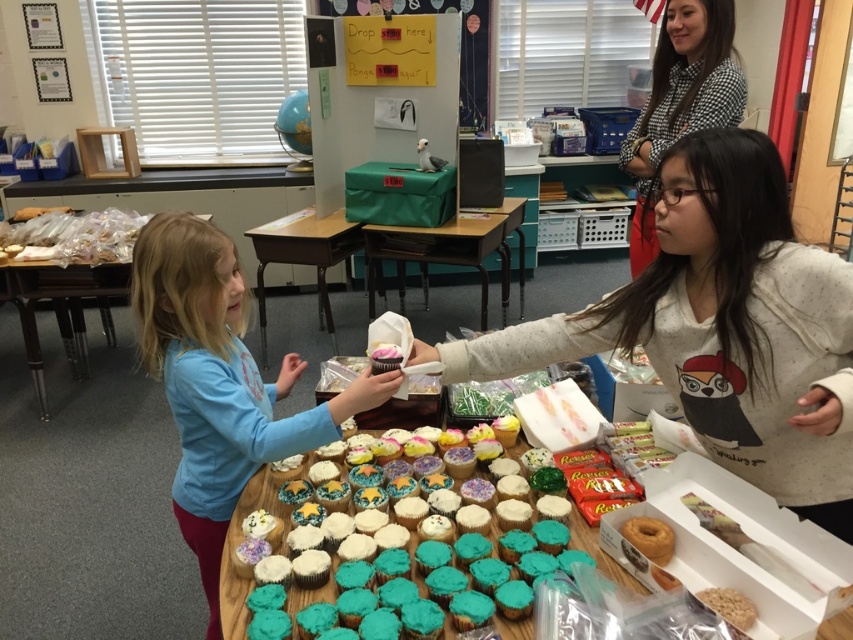
Between plaid shirt at upper right and white cardboard table at center, which one appears on the left side from the viewer's perspective?

Positioned to the left is white cardboard table at center.

Is plaid shirt at upper right wider than white cardboard table at center?

In fact, plaid shirt at upper right might be narrower than white cardboard table at center.

The height and width of the screenshot is (640, 853). Describe the element at coordinates (682, 100) in the screenshot. I see `plaid shirt at upper right` at that location.

I want to click on plaid shirt at upper right, so click(x=682, y=100).

How much distance is there between plaid shirt at upper right and clear plastic bag at left?

2.68 meters

Is plaid shirt at upper right above clear plastic bag at left?

Correct, plaid shirt at upper right is located above clear plastic bag at left.

Which is behind, point (722, 86) or point (19, 269)?

Point (19, 269)

Identify the location of plaid shirt at upper right. (682, 100).

Does green fabric table at center appear over white cardboard table at center?

Indeed, green fabric table at center is positioned over white cardboard table at center.

Does point (485, 241) come behind point (315, 264)?

No, (485, 241) is closer to viewer.

You are a GUI agent. You are given a task and a screenshot of the screen. Output one action in this format:
    pyautogui.click(x=<x>, y=<y>)
    Task: Click on the green fabric table at center
    The image size is (853, 640).
    Given the screenshot: What is the action you would take?
    pyautogui.click(x=447, y=252)